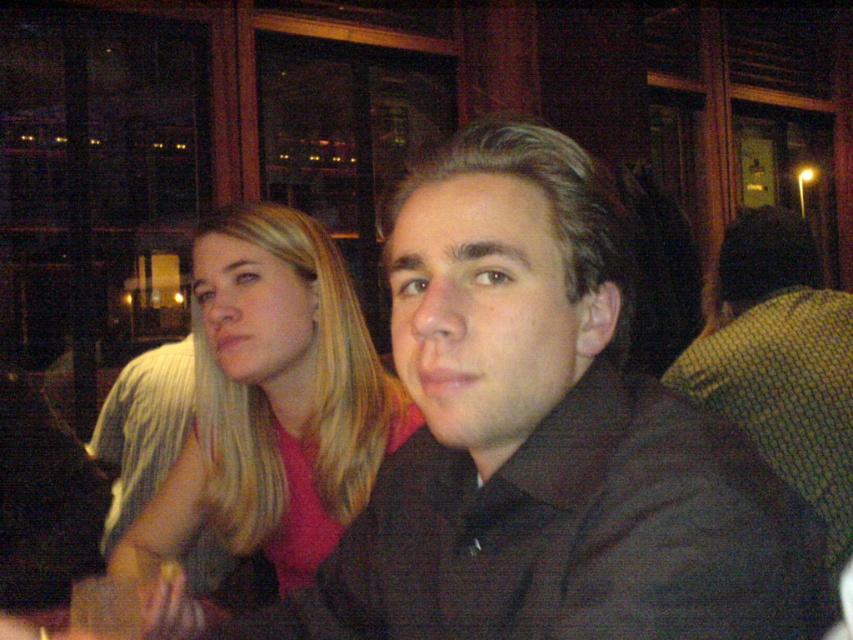
Image resolution: width=853 pixels, height=640 pixels. Describe the element at coordinates (541, 440) in the screenshot. I see `matte black shirt at center` at that location.

Which is behind, point (579, 196) or point (375, 436)?

Point (375, 436)

You are a GUI agent. You are given a task and a screenshot of the screen. Output one action in this format:
    pyautogui.click(x=<x>, y=<y>)
    Task: Click on the matte black shirt at center
    This screenshot has height=640, width=853.
    Given the screenshot: What is the action you would take?
    pyautogui.click(x=541, y=440)

Consider the image. Which is more to the left, matte black shirt at center or black matte shirt at center?

From the viewer's perspective, matte black shirt at center appears more on the left side.

Does point (660, 428) come farther from viewer compared to point (828, 385)?

No, it is not.

Describe the element at coordinates (541, 440) in the screenshot. The height and width of the screenshot is (640, 853). I see `matte black shirt at center` at that location.

This screenshot has width=853, height=640. I want to click on matte black shirt at center, so [541, 440].

Is blonde hair at left behind black matte shirt at center?

No, it is in front of black matte shirt at center.

Who is more distant from viewer, (392, 429) or (701, 401)?

The point (701, 401) is more distant.

What are the coordinates of `blonde hair at left` in the screenshot? It's located at (271, 403).

Where is `blonde hair at left`? blonde hair at left is located at coordinates (271, 403).